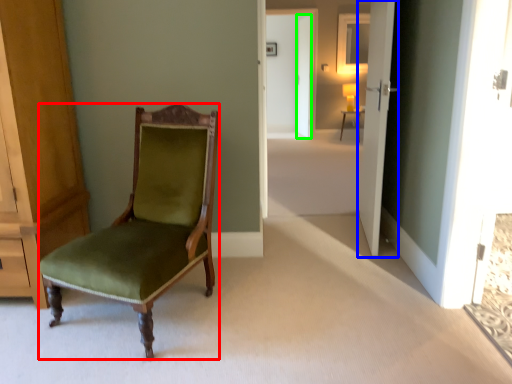
Question: Which object is the farthest from chair (highlighted by a red box)? Choose among these: door (highlighted by a blue box) or door (highlighted by a green box).

Choices:
 (A) door
 (B) door

Answer: (B)